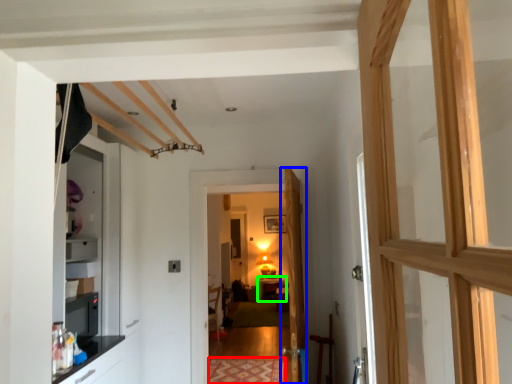
Question: Which object is positioned farthest from mat (highlighted by a red box)? Select from door (highlighted by a blue box) and table (highlighted by a green box).

Choices:
 (A) door
 (B) table

Answer: (B)